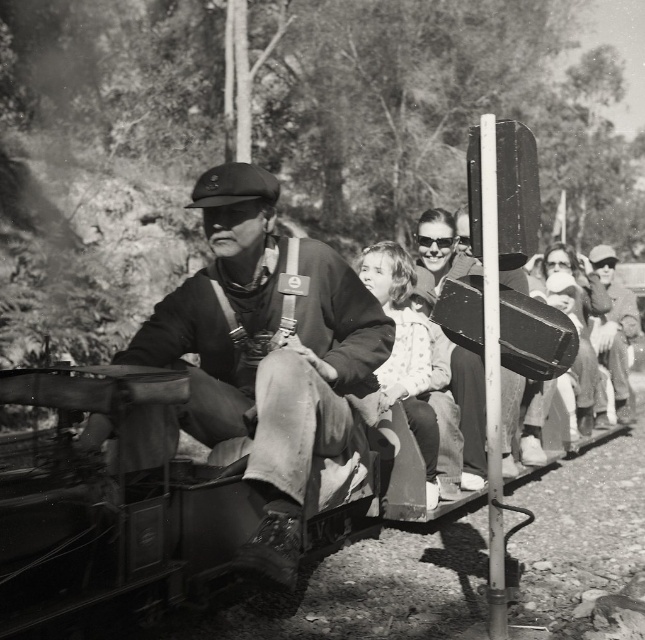
Based on the scene described, can the light beige fabric dress at center fit on the leather seat at center?

The leather seat at center is bigger than the light beige fabric dress at center, so yes, the light beige fabric dress at center can fit on the leather seat at center.